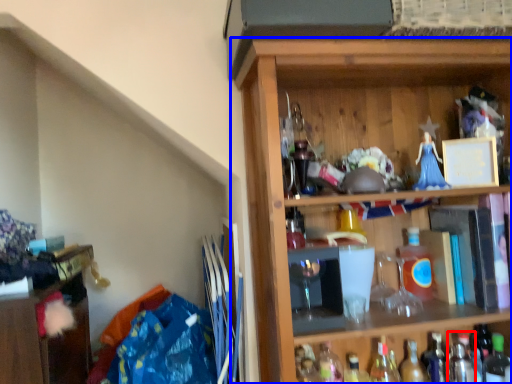
Question: Which object appears closest to the camera in this image, bottle (highlighted by a red box) or shelf (highlighted by a blue box)?

Choices:
 (A) bottle
 (B) shelf

Answer: (B)